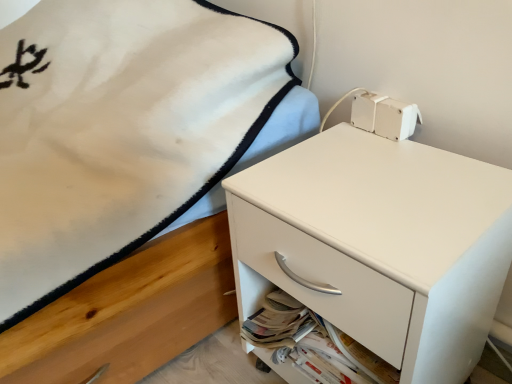
Question: Considering the relative sizes of white matte drawer at lower right and white matte chest of drawers at center in the image provided, is white matte drawer at lower right thinner than white matte chest of drawers at center?

Choices:
 (A) yes
 (B) no

Answer: (A)

Question: Is white matte drawer at lower right with white matte chest of drawers at center?

Choices:
 (A) yes
 (B) no

Answer: (A)

Question: Is white matte drawer at lower right completely or partially outside of white matte chest of drawers at center?

Choices:
 (A) no
 (B) yes

Answer: (A)

Question: Considering the relative positions of white matte drawer at lower right and white matte chest of drawers at center in the image provided, is white matte drawer at lower right behind white matte chest of drawers at center?

Choices:
 (A) no
 (B) yes

Answer: (B)

Question: Is white matte drawer at lower right positioned before white matte chest of drawers at center?

Choices:
 (A) yes
 (B) no

Answer: (B)

Question: From a real-world perspective, is white matte drawer at lower right under white matte chest of drawers at center?

Choices:
 (A) no
 (B) yes

Answer: (B)

Question: From a real-world perspective, is white matte chest of drawers at center located higher than white matte drawer at lower right?

Choices:
 (A) no
 (B) yes

Answer: (B)

Question: From a real-world perspective, is white matte chest of drawers at center below white matte drawer at lower right?

Choices:
 (A) no
 (B) yes

Answer: (A)

Question: Is white matte chest of drawers at center next to white matte drawer at lower right and touching it?

Choices:
 (A) yes
 (B) no

Answer: (A)

Question: Is white matte chest of drawers at center at the left side of white matte drawer at lower right?

Choices:
 (A) yes
 (B) no

Answer: (B)

Question: From the image's perspective, is white matte chest of drawers at center above white matte drawer at lower right?

Choices:
 (A) yes
 (B) no

Answer: (A)

Question: Does white matte chest of drawers at center have a lesser width compared to white matte drawer at lower right?

Choices:
 (A) yes
 (B) no

Answer: (B)

Question: In terms of height, does white matte chest of drawers at center look taller or shorter compared to white matte drawer at lower right?

Choices:
 (A) short
 (B) tall

Answer: (B)